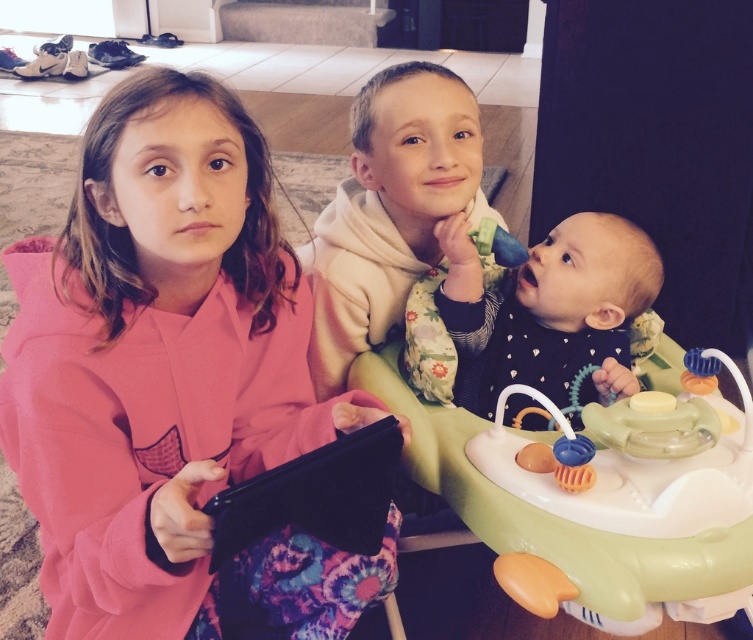
In the scene described, there are a white soft hoodie at center and a soft green highchair at center. From the perspective of someone standing in the room, which object is positioned to the left?

The white soft hoodie at center is positioned to the left of the soft green highchair at center.

You are a parent trying to dress your child in either the pink matte hoodie at center or the soft green highchair at center. Which clothing item would you choose if you want something bigger?

The pink matte hoodie at center is larger in size than the soft green highchair at center, so you should choose the pink matte hoodie at center.